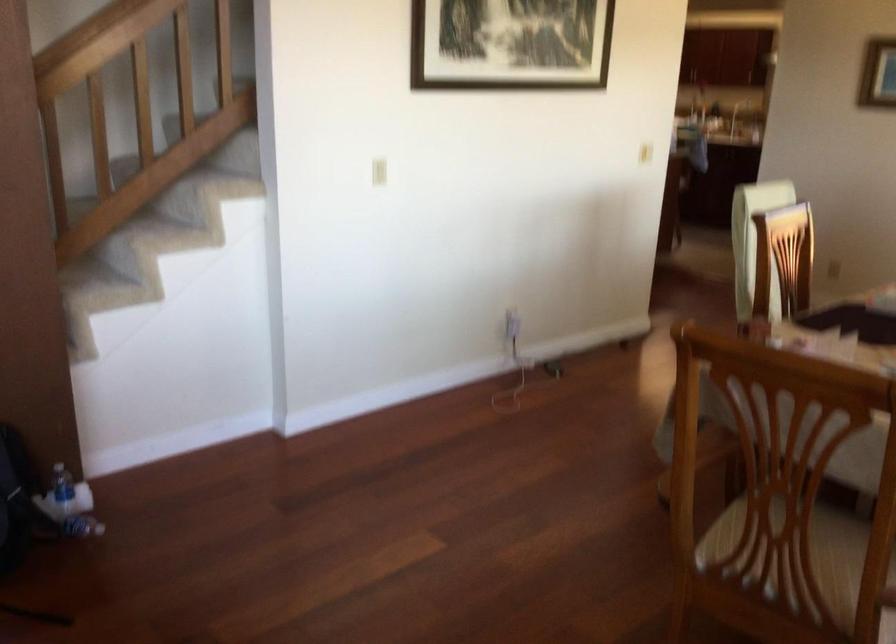
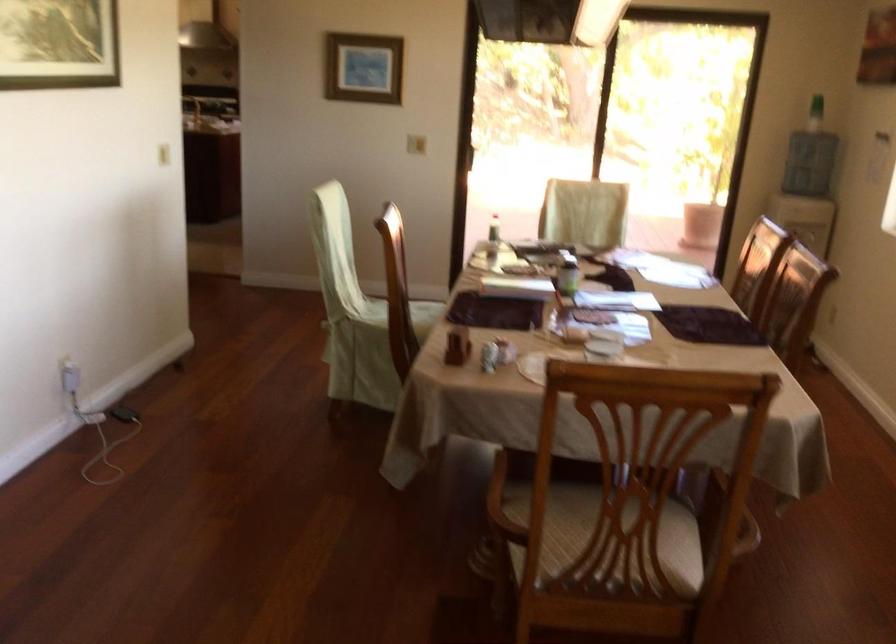
Where in the second image is the point corresponding to pixel 630 500 from the first image?

(316, 540)